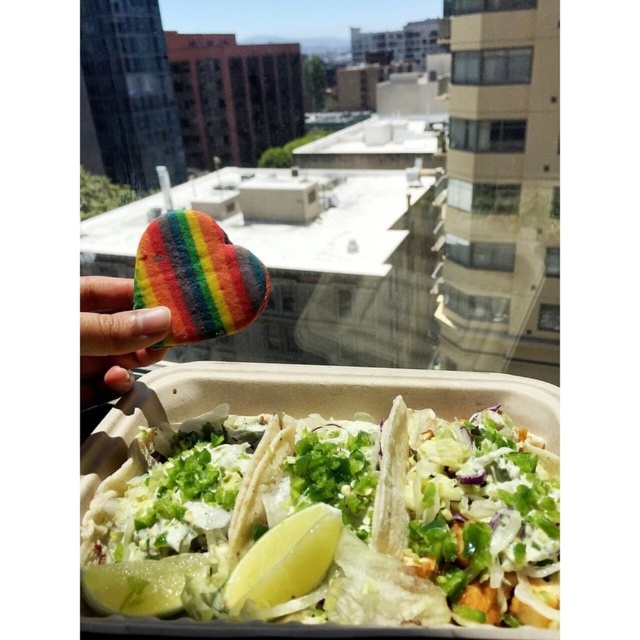
Who is higher up, green leafy lettuce at center or green matte lemon at lower left?

green leafy lettuce at center is above.

Consider the image. Can you confirm if green leafy lettuce at center is positioned below green matte lemon at lower left?

Incorrect, green leafy lettuce at center is not positioned below green matte lemon at lower left.

This screenshot has height=640, width=640. Identify the location of green leafy lettuce at center. (196, 522).

Which is behind, point (508, 438) or point (102, 282)?

Positioned behind is point (508, 438).

Who is higher up, white paper taco at center or rainbow cookie at upper left?

rainbow cookie at upper left is higher up.

Between point (456, 429) and point (134, 323), which one is positioned behind?

The point (456, 429) is behind.

Find the location of a particular element. This screenshot has width=640, height=640. white paper taco at center is located at coordinates coord(472,513).

Is green leafy lettuce at center wider than rainbow cookie at upper left?

Yes, green leafy lettuce at center is wider than rainbow cookie at upper left.

Which is behind, point (269, 524) or point (99, 323)?

Point (269, 524)

Who is more forward, (x=208, y=460) or (x=113, y=296)?

Point (x=208, y=460) is more forward.

The image size is (640, 640). I want to click on green leafy lettuce at center, so click(x=196, y=522).